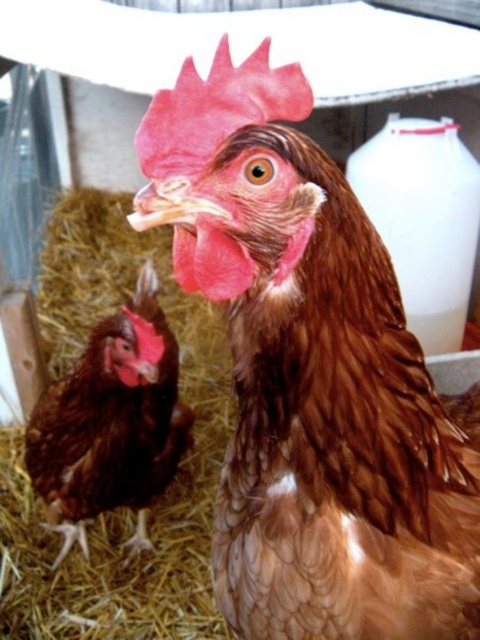
Can you confirm if brown feathered chicken at center is shorter than brown feathered chicken at lower left?

Yes.

Consider the image. Between brown feathered chicken at center and brown feathered chicken at lower left, which one has less height?

With less height is brown feathered chicken at center.

Identify the location of brown feathered chicken at center. This screenshot has height=640, width=480. (310, 376).